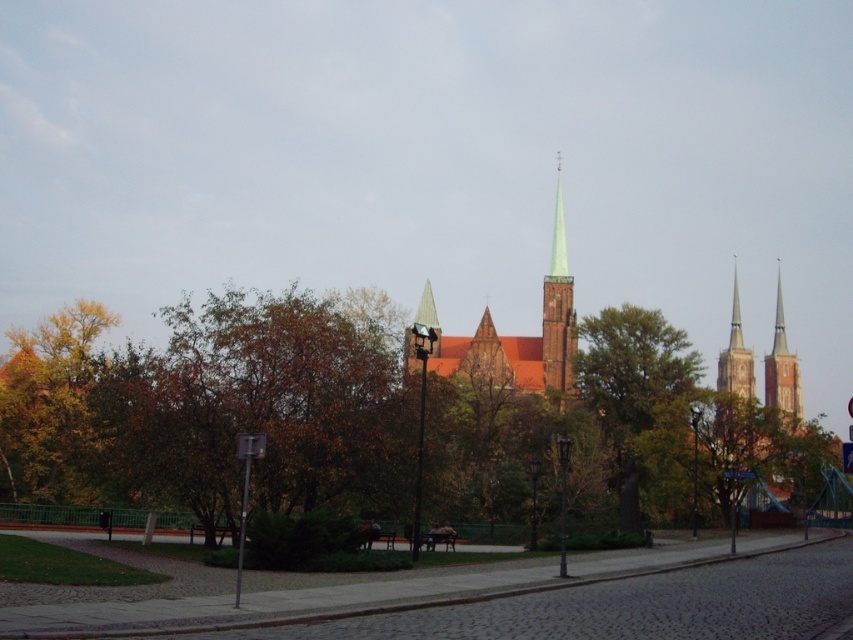
Does green leafy tree at center appear on the right side of green glass spire at center?

Correct, you'll find green leafy tree at center to the right of green glass spire at center.

Is point (619, 516) farther from camera compared to point (554, 388)?

No, (619, 516) is in front of (554, 388).

Find the location of a particular element. This screenshot has width=853, height=640. green leafy tree at center is located at coordinates (631, 388).